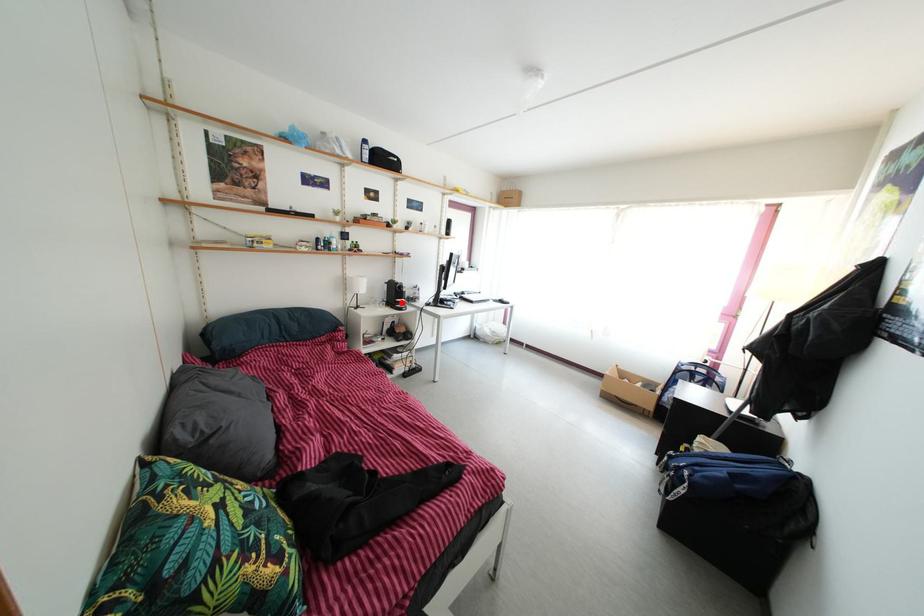
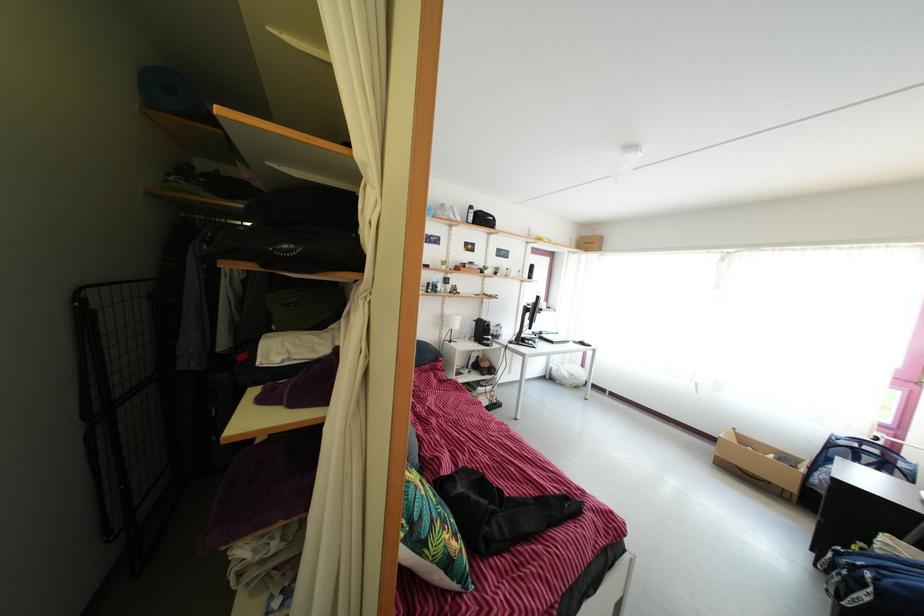
The point at the highlighted location is marked in the first image. Where is the corresponding point in the second image?

(489, 339)